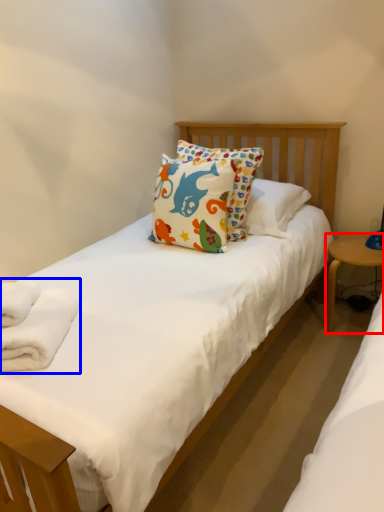
Question: Among these objects, which one is farthest to the camera, table (highlighted by a red box) or bath towel (highlighted by a blue box)?

Choices:
 (A) table
 (B) bath towel

Answer: (A)